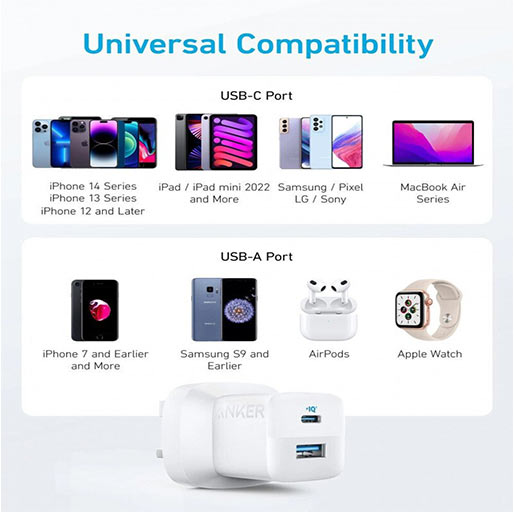
The width and height of the screenshot is (514, 512). I want to click on phone, so click(x=82, y=292).